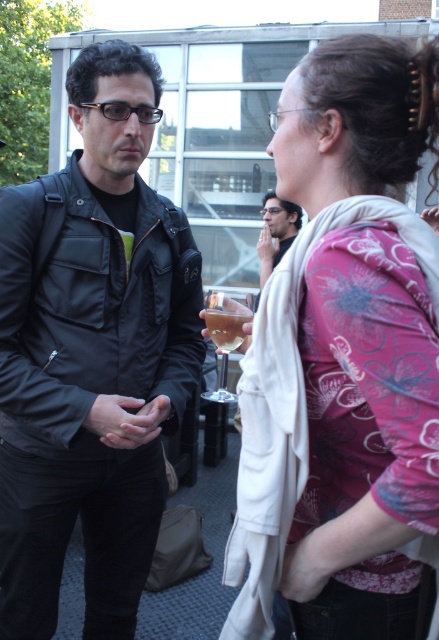
Does clear glass wine glass at center appear over translucent glass cup at center?

No.

Who is lower down, clear glass wine glass at center or translucent glass cup at center?

clear glass wine glass at center is lower down.

I want to click on clear glass wine glass at center, so click(x=225, y=337).

Does clear glass wine glass at center appear on the left side of matte black jacket at center?

Indeed, clear glass wine glass at center is positioned on the left side of matte black jacket at center.

Can you confirm if clear glass wine glass at center is shorter than matte black jacket at center?

Correct, clear glass wine glass at center is not as tall as matte black jacket at center.

Does point (243, 316) lie in front of point (280, 228)?

Yes, it is in front of point (280, 228).

At what (x,y) coordinates should I click in order to perform the action: click on clear glass wine glass at center. Please return your answer as a coordinate pair (x, y). This screenshot has height=640, width=439. Looking at the image, I should click on (225, 337).

This screenshot has width=439, height=640. Describe the element at coordinates (92, 356) in the screenshot. I see `matte black jacket at left` at that location.

Does matte black jacket at left have a greater height compared to clear glass wine glass at center?

Indeed, matte black jacket at left has a greater height compared to clear glass wine glass at center.

Where is `matte black jacket at left`? The image size is (439, 640). matte black jacket at left is located at coordinates (92, 356).